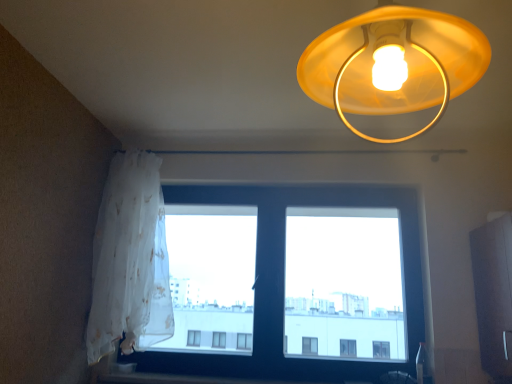
What do you see at coordinates (130, 261) in the screenshot? The height and width of the screenshot is (384, 512). I see `white sheer curtain at left` at bounding box center [130, 261].

Measure the distance between point (111,373) and camera.

A distance of 7.52 feet exists between point (111,373) and camera.

Measure the distance between transparent fabric at lower left and camera.

A distance of 2.28 meters exists between transparent fabric at lower left and camera.

What do you see at coordinates (393, 64) in the screenshot?
I see `translucent yellow plastic lampshade at upper center` at bounding box center [393, 64].

Identify the location of white sheer curtain at left. [130, 261].

Is transparent fabric at lower left behind white sheer curtain at left?

That is True.

Can you tell me how much transparent fabric at lower left and white sheer curtain at left differ in facing direction?

transparent fabric at lower left and white sheer curtain at left are facing 2.13 degrees away from each other.

Which of these two, transparent fabric at lower left or white sheer curtain at left, is smaller?

white sheer curtain at left is smaller.

From the image's perspective, is transparent fabric at lower left over white sheer curtain at left?

No, from the image's perspective, transparent fabric at lower left is not on top of white sheer curtain at left.

Is point (479, 56) closer or farther from the camera than point (215, 378)?

Clearly, point (479, 56) is closer to the camera than point (215, 378).

Based on their sizes in the image, would you say translucent yellow plastic lampshade at upper center is bigger or smaller than smooth wood window sill at lower center?

translucent yellow plastic lampshade at upper center is bigger than smooth wood window sill at lower center.

Considering the positions of objects translucent yellow plastic lampshade at upper center and smooth wood window sill at lower center in the image provided, who is more to the left, translucent yellow plastic lampshade at upper center or smooth wood window sill at lower center?

From the viewer's perspective, smooth wood window sill at lower center appears more on the left side.

From a real-world perspective, does translucent yellow plastic lampshade at upper center stand above smooth wood window sill at lower center?

Yes, from a real-world perspective, translucent yellow plastic lampshade at upper center is above smooth wood window sill at lower center.

From the image's perspective, would you say white sheer curtain at left is positioned over smooth wood window sill at lower center?

Indeed, from the image's perspective, white sheer curtain at left is shown above smooth wood window sill at lower center.

Can you confirm if white sheer curtain at left is bigger than smooth wood window sill at lower center?

Indeed, white sheer curtain at left has a larger size compared to smooth wood window sill at lower center.

Where is `window sill below the white sheer curtain at left (from the image's perspective)`? window sill below the white sheer curtain at left (from the image's perspective) is located at coordinates [180, 379].

Looking at their sizes, would you say white sheer curtain at left is wider or thinner than smooth wood window sill at lower center?

In the image, white sheer curtain at left appears to be wider than smooth wood window sill at lower center.

Consider the image. What's the angular difference between translucent yellow plastic lampshade at upper center and transparent fabric at lower left's facing directions?

The angular difference between translucent yellow plastic lampshade at upper center and transparent fabric at lower left is 1.28 degrees.

Is transparent fabric at lower left a part of translucent yellow plastic lampshade at upper center?

Actually, transparent fabric at lower left is outside translucent yellow plastic lampshade at upper center.

Would you consider translucent yellow plastic lampshade at upper center to be distant from transparent fabric at lower left?

Indeed, translucent yellow plastic lampshade at upper center is not near transparent fabric at lower left.

Is translucent yellow plastic lampshade at upper center thinner than transparent fabric at lower left?

Incorrect, the width of translucent yellow plastic lampshade at upper center is not less than that of transparent fabric at lower left.

Looking at this image, would you say smooth wood window sill at lower center is a long distance from transparent fabric at lower left?

smooth wood window sill at lower center is near transparent fabric at lower left, not far away.

From a real-world perspective, is smooth wood window sill at lower center physically located above or below transparent fabric at lower left?

From a real-world perspective, smooth wood window sill at lower center is physically below transparent fabric at lower left.

Consider the image. Is transparent fabric at lower left at the back of smooth wood window sill at lower center?

Yes.

How distant is smooth wood window sill at lower center from transparent fabric at lower left?

smooth wood window sill at lower center and transparent fabric at lower left are 21.41 inches apart.

From the image's perspective, is translucent yellow plastic lampshade at upper center beneath white sheer curtain at left?

Actually, translucent yellow plastic lampshade at upper center appears above white sheer curtain at left in the image.

Would you say translucent yellow plastic lampshade at upper center is inside or outside white sheer curtain at left?

translucent yellow plastic lampshade at upper center exists outside the volume of white sheer curtain at left.

Is point (350, 60) closer or farther from the camera than point (139, 303)?

Point (350, 60) is closer to the camera than point (139, 303).

Is point (98, 323) less distant than point (189, 364)?

Yes, point (98, 323) is closer to viewer.

Can you confirm if white sheer curtain at left is shorter than transparent fabric at lower left?

Yes, white sheer curtain at left is shorter than transparent fabric at lower left.

How distant is white sheer curtain at left from transparent fabric at lower left?

A distance of 19.82 inches exists between white sheer curtain at left and transparent fabric at lower left.

Is white sheer curtain at left oriented away from transparent fabric at lower left?

Absolutely, white sheer curtain at left is directed away from transparent fabric at lower left.

Find the location of a particular element. window located below the white sheer curtain at left (from the image's perspective) is located at coordinates (283, 283).

The height and width of the screenshot is (384, 512). I want to click on window sill below the translucent yellow plastic lampshade at upper center (from a real-world perspective), so click(180, 379).

From the image, which object appears to be farther from transparent fabric at lower left, white sheer curtain at left or translucent yellow plastic lampshade at upper center?

translucent yellow plastic lampshade at upper center is further to transparent fabric at lower left.

Which object lies further to the anchor point smooth wood window sill at lower center, translucent yellow plastic lampshade at upper center or white sheer curtain at left?

Based on the image, translucent yellow plastic lampshade at upper center appears to be further to smooth wood window sill at lower center.

In the scene shown: Based on their spatial positions, is white sheer curtain at left or transparent fabric at lower left closer to smooth wood window sill at lower center?

The object closer to smooth wood window sill at lower center is transparent fabric at lower left.

Considering their positions, is white sheer curtain at left positioned closer to transparent fabric at lower left than smooth wood window sill at lower center?

white sheer curtain at left.

Looking at this image, looking at the image, which one is located closer to translucent yellow plastic lampshade at upper center, white sheer curtain at left or smooth wood window sill at lower center?

Based on the image, white sheer curtain at left appears to be nearer to translucent yellow plastic lampshade at upper center.

Which object lies nearer to the anchor point translucent yellow plastic lampshade at upper center, transparent fabric at lower left or white sheer curtain at left?

white sheer curtain at left lies closer to translucent yellow plastic lampshade at upper center than the other object.

Based on their spatial positions, is translucent yellow plastic lampshade at upper center or transparent fabric at lower left closer to smooth wood window sill at lower center?

Among the two, transparent fabric at lower left is located nearer to smooth wood window sill at lower center.

Looking at the image, which one is located closer to smooth wood window sill at lower center, white sheer curtain at left or translucent yellow plastic lampshade at upper center?

The object closer to smooth wood window sill at lower center is white sheer curtain at left.

Locate an element on the screen. The height and width of the screenshot is (384, 512). curtain between translucent yellow plastic lampshade at upper center and transparent fabric at lower left along the z-axis is located at coordinates (130, 261).

You are a GUI agent. You are given a task and a screenshot of the screen. Output one action in this format:
    pyautogui.click(x=<x>, y=<y>)
    Task: Click on the window sill between white sheer curtain at left and transparent fabric at lower left in the horizontal direction
    
    Given the screenshot: What is the action you would take?
    pyautogui.click(x=180, y=379)

The width and height of the screenshot is (512, 384). In order to click on window sill positioned between translucent yellow plastic lampshade at upper center and transparent fabric at lower left from near to far in this screenshot , I will do `click(180, 379)`.

This screenshot has width=512, height=384. In order to click on curtain between translucent yellow plastic lampshade at upper center and smooth wood window sill at lower center in the front-back direction in this screenshot , I will do `click(130, 261)`.